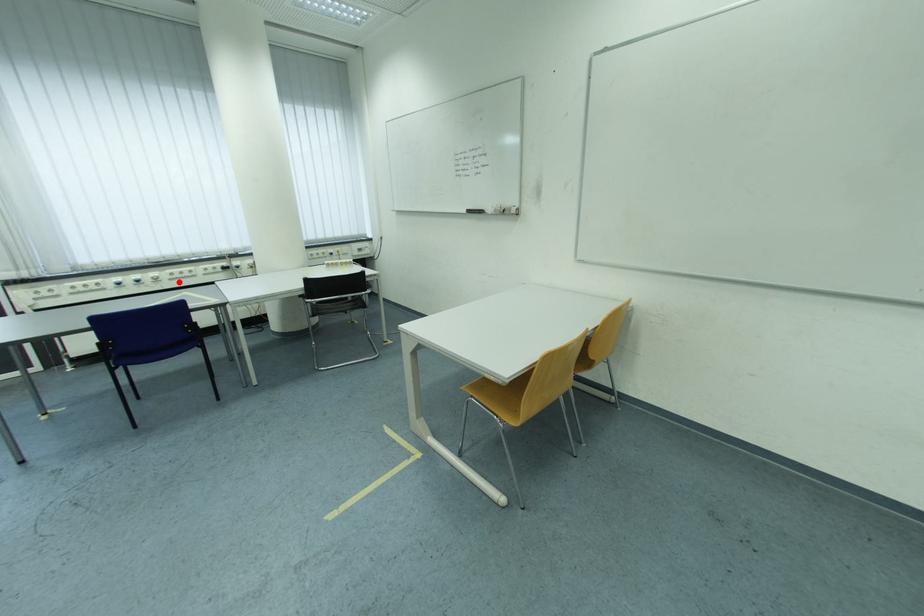
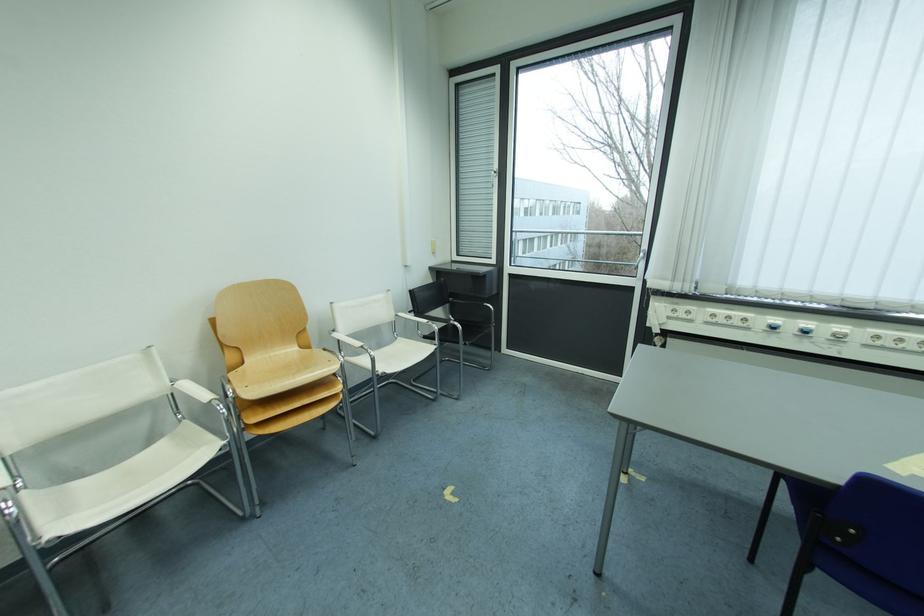
Find the pixel in the second image that matches the highlighted location in the first image.

(874, 347)